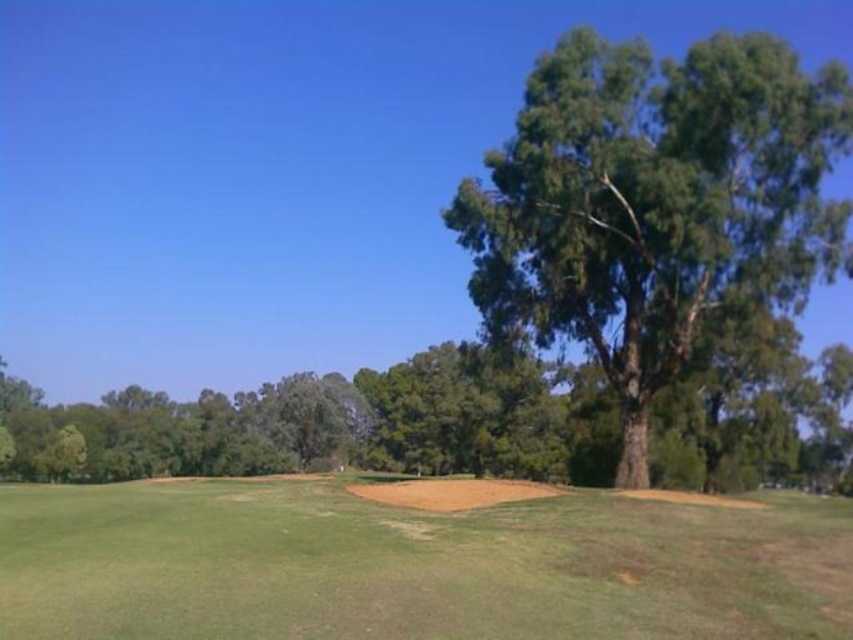
Describe the element at coordinates (415, 566) in the screenshot. Image resolution: width=853 pixels, height=640 pixels. I see `green grassy field at center` at that location.

Which is in front, point (421, 518) or point (456, 224)?

Point (421, 518) is more forward.

The width and height of the screenshot is (853, 640). What do you see at coordinates (415, 566) in the screenshot?
I see `green grassy field at center` at bounding box center [415, 566].

I want to click on green grassy field at center, so click(415, 566).